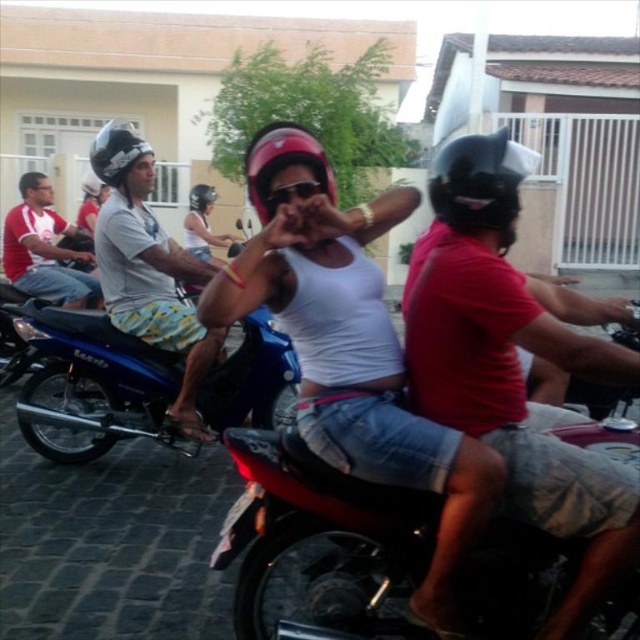
Question: Can you confirm if pink matte helmet at center is positioned above sunglasses at center?

Choices:
 (A) no
 (B) yes

Answer: (B)

Question: Estimate the real-world distances between objects in this image. Which object is farther from the brushed metal helmet at left?

Choices:
 (A) matte gray helmet at left
 (B) sunglasses at center

Answer: (B)

Question: Can you confirm if red matte helmet at center is positioned to the right of sunglasses at center?

Choices:
 (A) no
 (B) yes

Answer: (B)

Question: Which object is closer to the camera taking this photo?

Choices:
 (A) sunglasses at center
 (B) brushed metal helmet at center
 (C) shiny red motorcycle at center

Answer: (C)

Question: Considering the real-world distances, which object is farthest from the white matte tank top at center?

Choices:
 (A) blue metallic motorcycle at center
 (B) shiny red motorcycle at center

Answer: (A)

Question: From the image, what is the correct spatial relationship of sunglasses at center in relation to brushed metal helmet at center?

Choices:
 (A) left
 (B) right

Answer: (B)